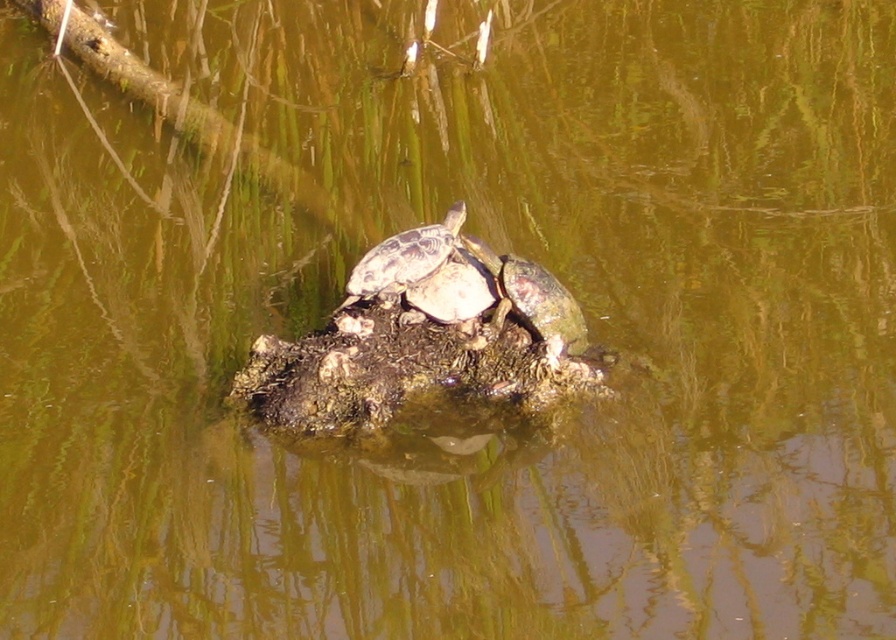
You are a photographer trying to capture the shiny brown tortoise at center in the serene aquatic scene. The camera you are using has a fixed focus point at coordinates point (403, 260). Will the focus point be positioned correctly to capture the shiny brown tortoise at center?

Yes, the focus point at point (403, 260) is positioned correctly to capture the shiny brown tortoise at center because the point indicates the location of the tortoise.